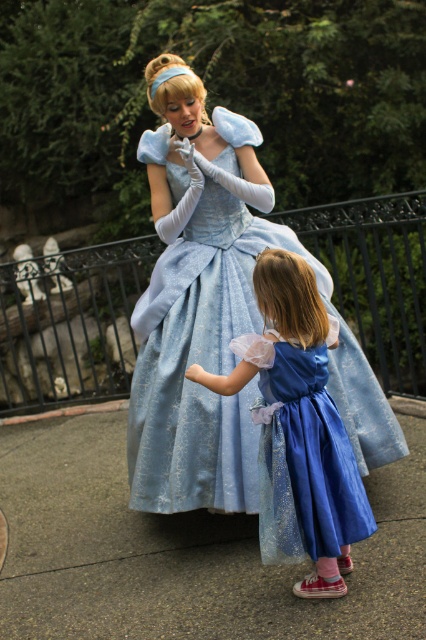
Question: Does light blue satin dress at center come behind matte blue dress at center?

Choices:
 (A) no
 (B) yes

Answer: (B)

Question: Which point is closer to the camera?

Choices:
 (A) matte blue dress at center
 (B) light blue satin dress at center

Answer: (A)

Question: Which of the following is the farthest from the observer?

Choices:
 (A) (135, 429)
 (B) (305, 372)

Answer: (A)

Question: Which point is farther from the camera taking this photo?

Choices:
 (A) (144, 492)
 (B) (262, 419)

Answer: (A)

Question: Is light blue satin dress at center thinner than matte blue dress at center?

Choices:
 (A) yes
 (B) no

Answer: (B)

Question: Is light blue satin dress at center further to the viewer compared to matte blue dress at center?

Choices:
 (A) no
 (B) yes

Answer: (B)